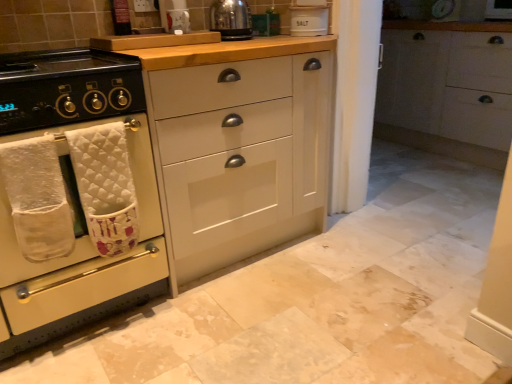
Question: Does shiny metallic kettle at upper center lie behind white quilted bath towel at left, positioned as the 2th bath towel in left-to-right order?

Choices:
 (A) yes
 (B) no

Answer: (A)

Question: Is shiny metallic kettle at upper center closer to camera compared to white quilted bath towel at left, positioned as the 2th bath towel in left-to-right order?

Choices:
 (A) no
 (B) yes

Answer: (A)

Question: From the image's perspective, does shiny metallic kettle at upper center appear higher than white quilted bath towel at left, the 1th bath towel from the right?

Choices:
 (A) yes
 (B) no

Answer: (A)

Question: Considering the relative sizes of shiny metallic kettle at upper center and white quilted bath towel at left, the 1th bath towel from the right, in the image provided, is shiny metallic kettle at upper center shorter than white quilted bath towel at left, the 1th bath towel from the right,?

Choices:
 (A) no
 (B) yes

Answer: (B)

Question: Is shiny metallic kettle at upper center beside white quilted bath towel at left, positioned as the 2th bath towel in left-to-right order?

Choices:
 (A) yes
 (B) no

Answer: (B)

Question: Considering their positions, is white quilted bath towel at left, arranged as the 1th bath towel when viewed from the left, located in front of or behind black matte gas stove at left?

Choices:
 (A) behind
 (B) front

Answer: (A)

Question: From a real-world perspective, is white quilted bath towel at left, the 2th bath towel in the right-to-left sequence, above or below black matte gas stove at left?

Choices:
 (A) below
 (B) above

Answer: (A)

Question: Does point (22, 147) appear closer or farther from the camera than point (31, 72)?

Choices:
 (A) farther
 (B) closer

Answer: (B)

Question: Is white quilted bath towel at left, the 2th bath towel in the right-to-left sequence, taller or shorter than black matte gas stove at left?

Choices:
 (A) tall
 (B) short

Answer: (A)

Question: In terms of height, does shiny metallic kettle at upper center look taller or shorter compared to matte white cabinet at center, the 2th cabinetry from the left?

Choices:
 (A) short
 (B) tall

Answer: (A)

Question: Is shiny metallic kettle at upper center inside or outside of matte white cabinet at center, the 2th cabinetry from the left?

Choices:
 (A) outside
 (B) inside

Answer: (A)

Question: In the image, is shiny metallic kettle at upper center positioned in front of or behind matte white cabinet at center, the 2th cabinetry from the left?

Choices:
 (A) front
 (B) behind

Answer: (B)

Question: Is point (217, 28) positioned closer to the camera than point (288, 195)?

Choices:
 (A) farther
 (B) closer

Answer: (B)

Question: In terms of height, does white quilted bath towel at left, arranged as the 1th bath towel when viewed from the left, look taller or shorter compared to white quilted bath towel at left, positioned as the 2th bath towel in left-to-right order?

Choices:
 (A) tall
 (B) short

Answer: (B)

Question: Looking at their shapes, would you say white quilted bath towel at left, the 2th bath towel in the right-to-left sequence, is wider or thinner than white quilted bath towel at left, the 1th bath towel from the right?

Choices:
 (A) wide
 (B) thin

Answer: (B)